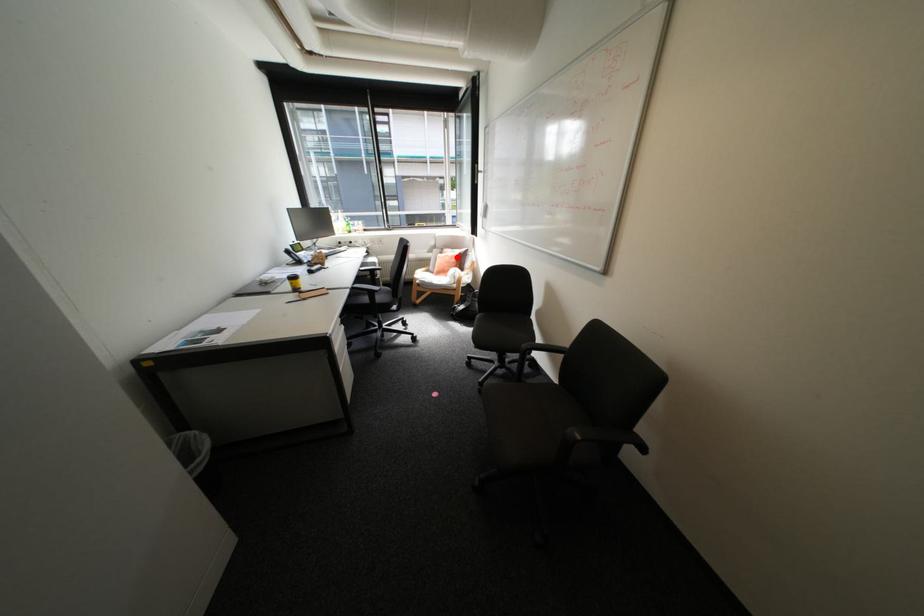
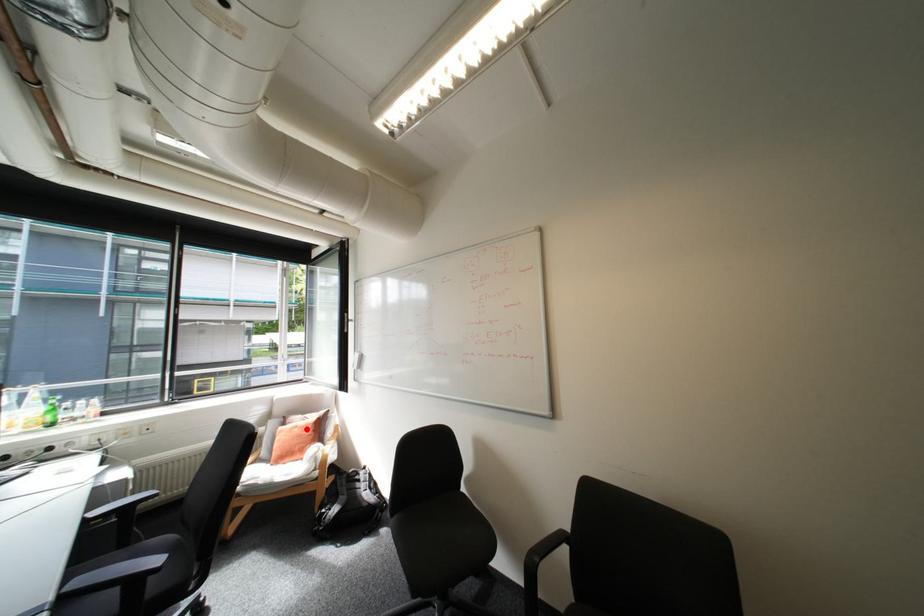
I am providing you with two images of the same scene from different viewpoints. A red point is marked on the first image and another point is marked on the second image. Is the red point in image1 aligned with the point shown in image2?

Yes